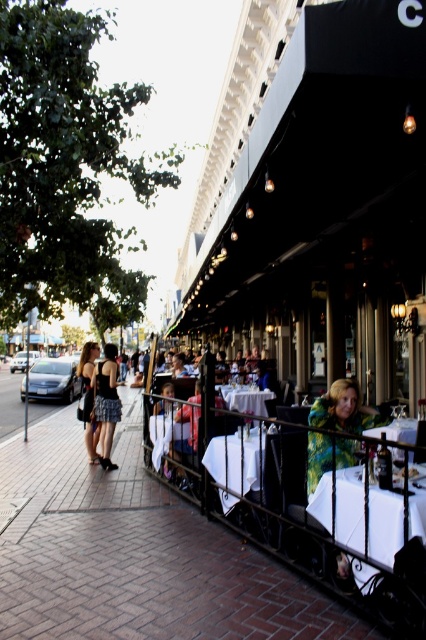
You are a photographer setting up for an event. You need to place a 1.5 meter wide backdrop behind the matte black dress at center and the white tablecloth at center. Which object requires the backdrop to be placed closer to it to ensure full coverage?

The white tablecloth at center requires the backdrop to be placed closer to it because its width is greater than the matte black dress at center.

You are a customer waiting to be seated at the restaurant. You see a white linen table at lower right and a matte black dress at left. Which object is located to the right of the other?

The white linen table at lower right is positioned on the right side of matte black dress at left.

You are a server at the restaurant and need to place a large dessert plate on the table. Considering the size of the white linen table at lower right and the matte black dress at left, which table should you choose?

The white linen table at lower right is smaller than the matte black dress at left, so you should choose the matte black dress at left for placing the large dessert plate since it is larger.